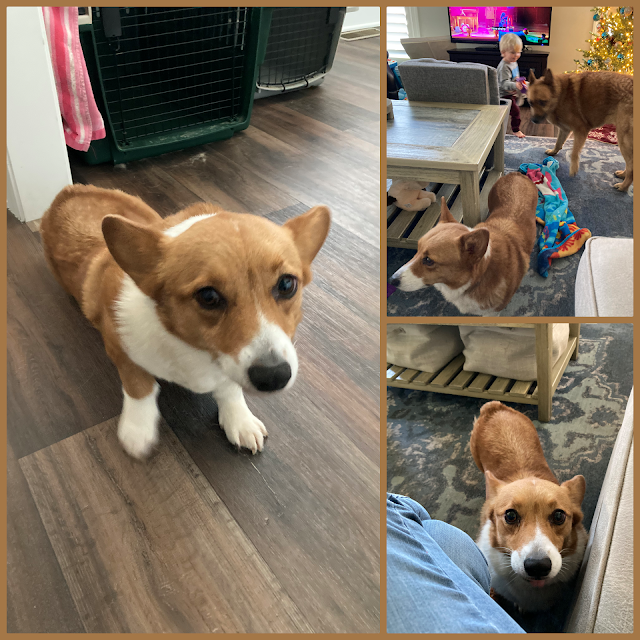
Find the location of a particular element. wash cloth is located at coordinates (68, 68).